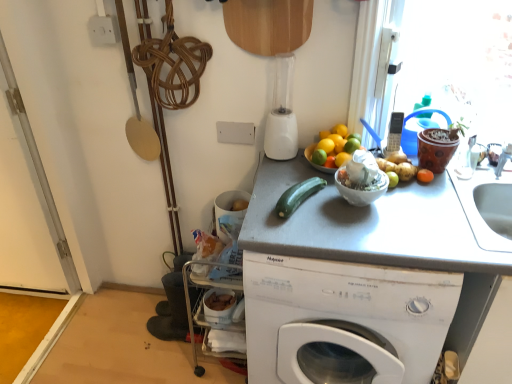
Locate an element on the screen. Image resolution: width=512 pixels, height=384 pixels. free space in front of orange matte at right is located at coordinates (431, 208).